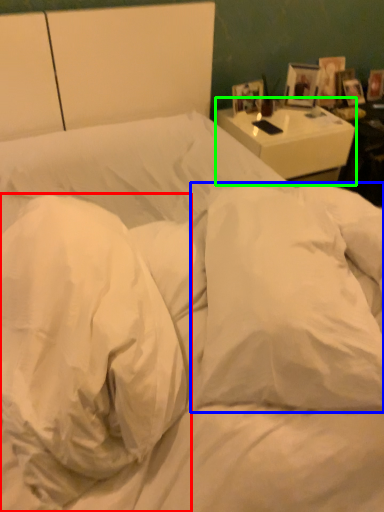
Question: Estimate the real-world distances between objects in this image. Which object is closer to pillow (highlighted by a red box), pillow (highlighted by a blue box) or nightstand (highlighted by a green box)?

Choices:
 (A) pillow
 (B) nightstand

Answer: (A)